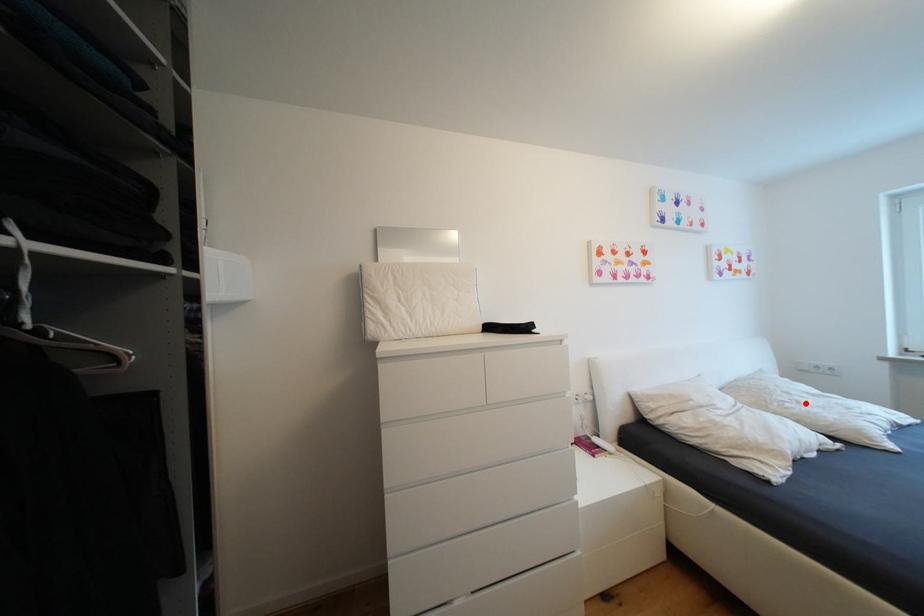
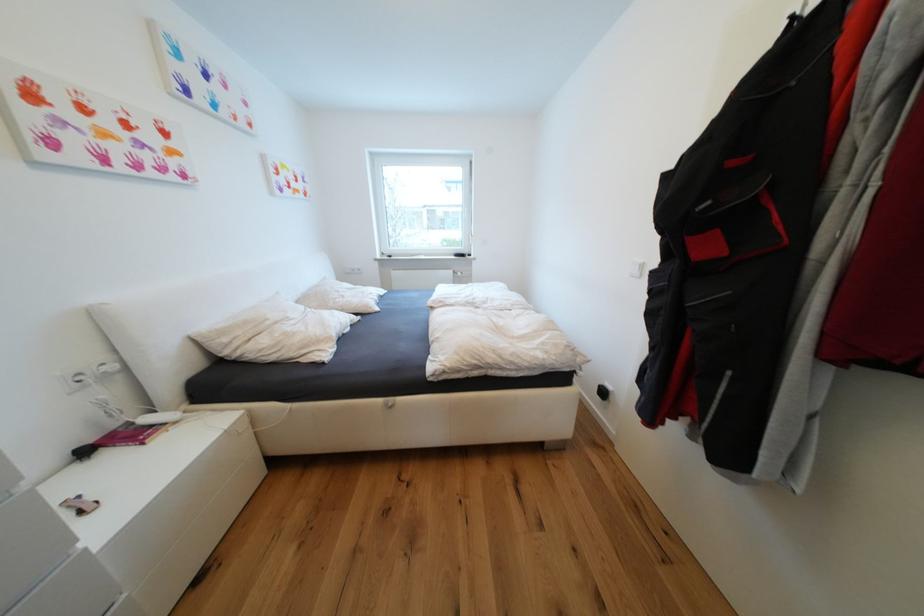
Question: I am providing you with two images of the same scene from different viewpoints. A red point is marked on the first image. Can you still see the location of the red point in image 2?

Choices:
 (A) Yes
 (B) No

Answer: (A)